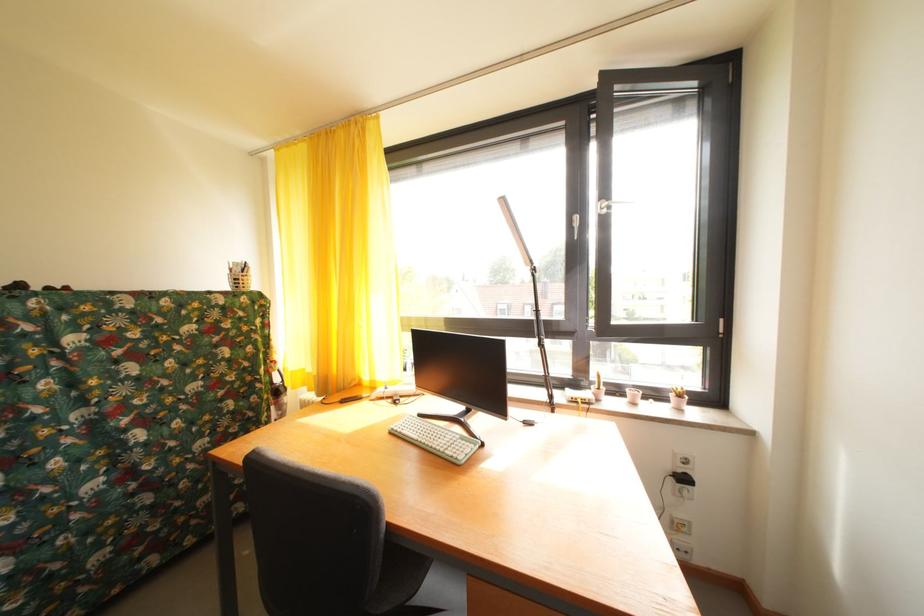
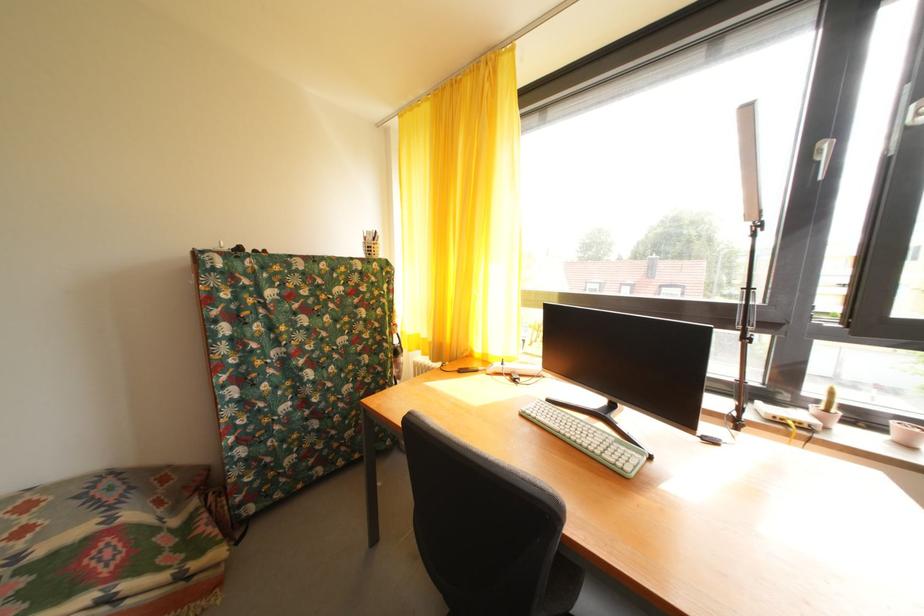
Question: Based on the continuous images, in which direction is the camera rotating? Reply with the corresponding letter.

Choices:
 (A) Left
 (B) Right
 (C) Up
 (D) Down

Answer: (A)